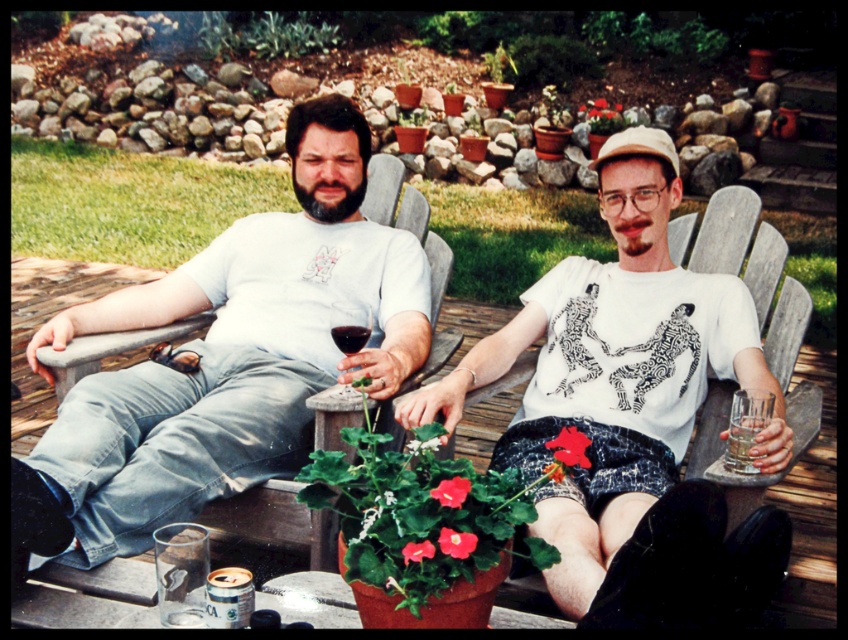
Question: Is white matte t-shirt at center bigger than clear glass water at right?

Choices:
 (A) no
 (B) yes

Answer: (B)

Question: Estimate the real-world distances between objects in this image. Which object is closer to the white matte t-shirt at center?

Choices:
 (A) dark red glass at center
 (B) matte white t-shirt at left
 (C) clear glass water at right
 (D) matte glass wine at center

Answer: (C)

Question: In this image, where is matte white t-shirt at left located relative to clear glass water at right?

Choices:
 (A) below
 (B) above

Answer: (B)

Question: Which of these objects is positioned closest to the matte glass wine at center?

Choices:
 (A) dark red glass at center
 (B) matte white t-shirt at left
 (C) white matte t-shirt at center

Answer: (A)

Question: Is white matte t-shirt at center behind matte glass wine at center?

Choices:
 (A) yes
 (B) no

Answer: (B)

Question: Estimate the real-world distances between objects in this image. Which object is farther from the dark red glass at center?

Choices:
 (A) matte white t-shirt at left
 (B) clear glass water at right

Answer: (B)